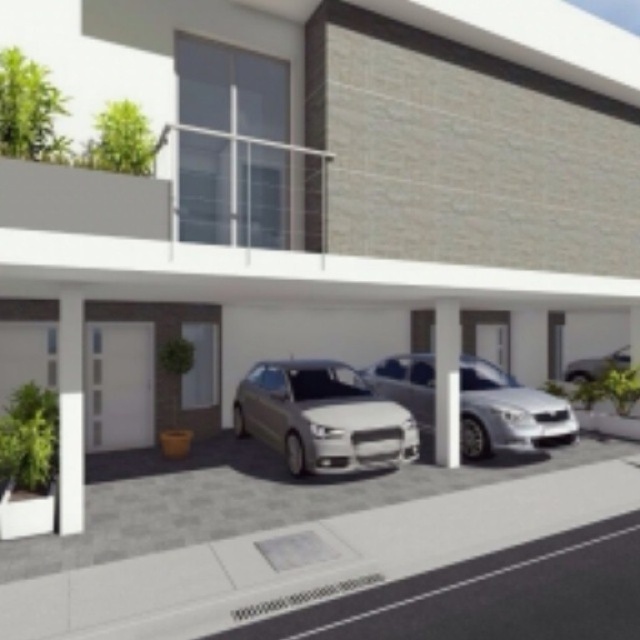
Question: Among these points, which one is farthest from the camera?

Choices:
 (A) (472, 456)
 (B) (417, 444)

Answer: (A)

Question: Does satin gold car at center have a larger size compared to satin silver car at center?

Choices:
 (A) yes
 (B) no

Answer: (A)

Question: Can you confirm if satin gold car at center is bigger than satin silver sedan at right?

Choices:
 (A) yes
 (B) no

Answer: (A)

Question: Which point appears farthest from the camera in this image?

Choices:
 (A) (288, 426)
 (B) (573, 374)

Answer: (B)

Question: Does satin gold car at center have a greater width compared to satin silver car at center?

Choices:
 (A) yes
 (B) no

Answer: (A)

Question: Which object is positioned closest to the satin gold car at center?

Choices:
 (A) satin silver car at center
 (B) satin silver sedan at right

Answer: (A)